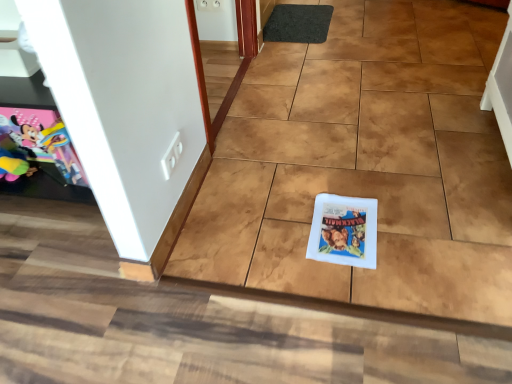
I want to click on free spot behind white paper comic book at center, acting as the second comic book starting from the left, so click(337, 184).